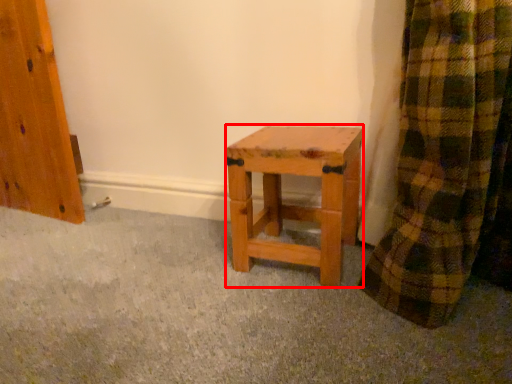
Question: In this image, where is stool (annotated by the red box) located relative to concrete?

Choices:
 (A) left
 (B) right

Answer: (B)